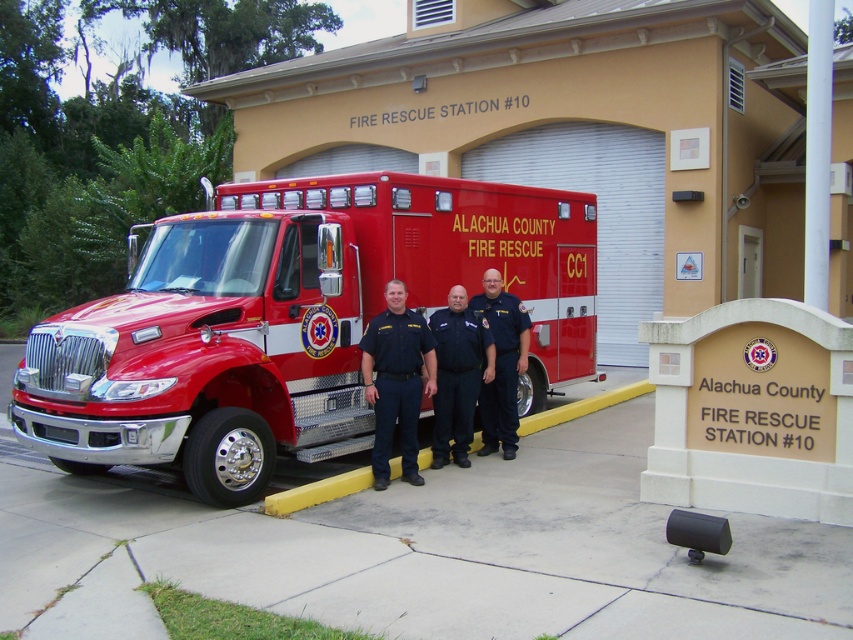
You are a firefighter at Alachua County Fire Rescue Station. You need to choose between the black uniform at center and the blue fabric uniform at center for a rescue mission. Which uniform has a wider width?

The black uniform at center has a greater width than the blue fabric uniform at center according to the description.